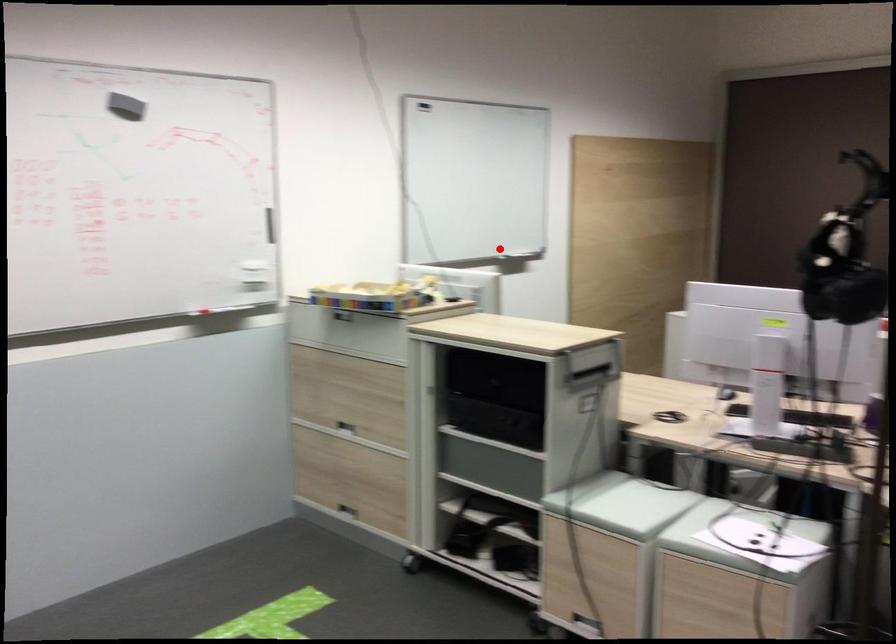
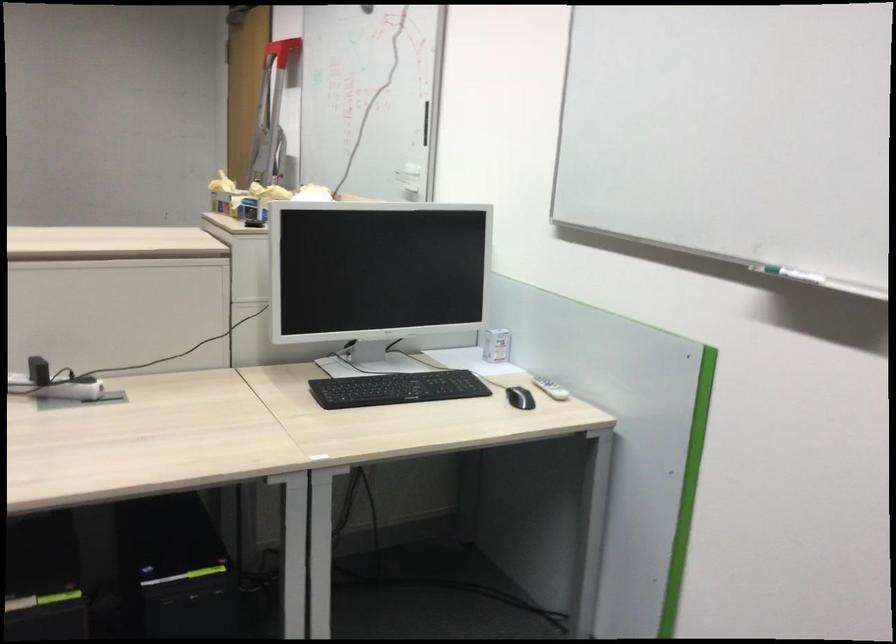
Question: I am providing you with two images of the same scene from different viewpoints. A red point is shown in image1. For the corresponding object point in image2, is it positioned nearer or farther from the camera?

Choices:
 (A) Nearer
 (B) Farther

Answer: (A)